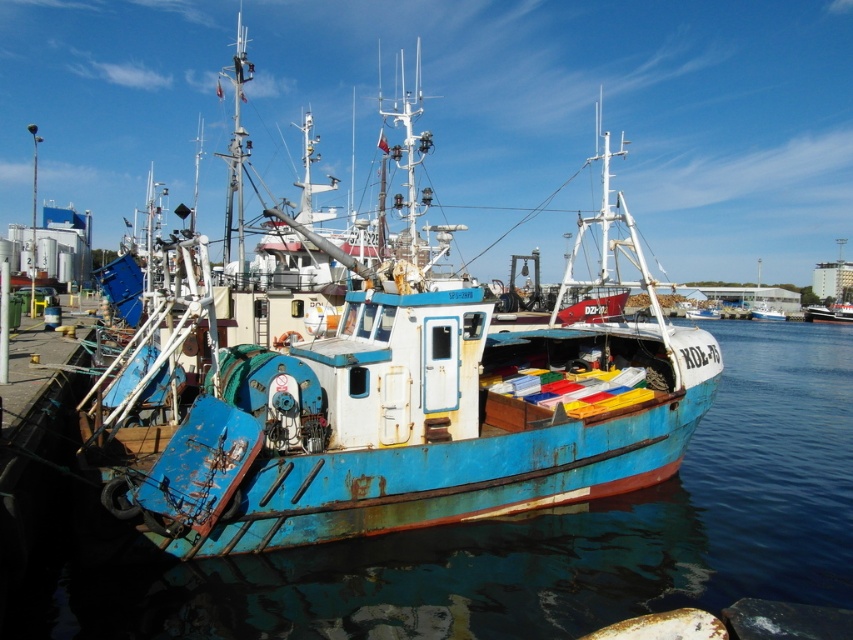
You are a marine biologist who needs to board the rusty metal boat at center for a research project. Based on the coordinates provided, can you determine if the boat is positioned centrally in the harbor? Explain your reasoning.

The coordinates of the rusty metal boat at center are given as point (387, 413). Since the coordinate system typically ranges from 0 to 1, a value of 0.5 in both axes would indicate the exact center. Here, the boat is slightly offset towards the right and bottom, so it is not perfectly centered in the harbor.

You are a marine biologist observing the harbor. You notice the rusty metal boat at center and the blue metallic water at center. Which object is positioned higher in the scene?

The rusty metal boat at center is above the blue metallic water at center, so it is positioned higher in the scene.

You are a harbor inspector checking the docking positions of vessels. According to the image, where is the rusty metal boat at center relative to the blue metallic water at center?

The rusty metal boat at center is positioned on the left side of blue metallic water at center.